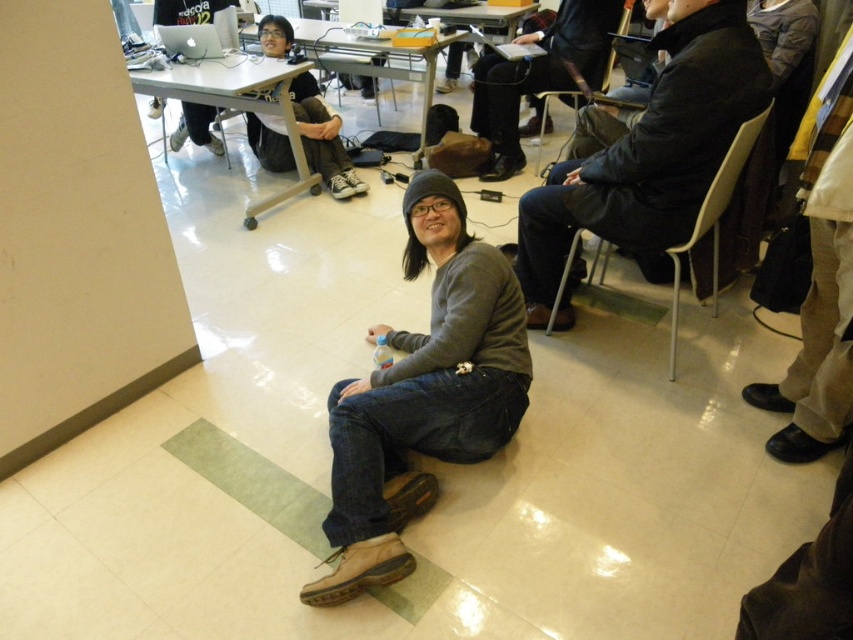
Question: In this image, where is gray matte sweater at center located relative to matte black laptop at upper left?

Choices:
 (A) right
 (B) left

Answer: (A)

Question: Can you confirm if dark gray sweater at center is wider than white plastic chair at right?

Choices:
 (A) no
 (B) yes

Answer: (B)

Question: Does dark gray sweater at center appear over matte black laptop at upper left?

Choices:
 (A) yes
 (B) no

Answer: (A)

Question: Which of the following is the farthest from the observer?

Choices:
 (A) matte black laptop at upper left
 (B) gray matte sweater at center

Answer: (A)

Question: Which of the following is the farthest from the observer?

Choices:
 (A) (202, 109)
 (B) (717, 202)
 (C) (419, 417)

Answer: (A)

Question: Which of the following is the farthest from the observer?

Choices:
 (A) (495, 177)
 (B) (341, 392)
 (C) (672, 248)

Answer: (A)